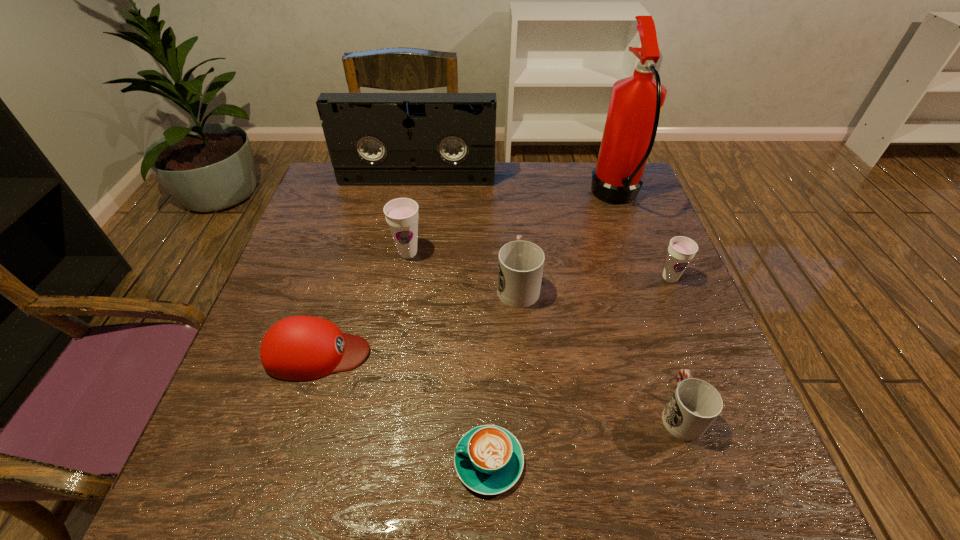
Locate an element on the screen. This screenshot has width=960, height=540. free space located on the handle side of the bigger red cup is located at coordinates (510, 183).

This screenshot has width=960, height=540. I want to click on vacant position located 0.270m on the handle side of the bigger red cup, so click(x=511, y=200).

You are a GUI agent. You are given a task and a screenshot of the screen. Output one action in this format:
    pyautogui.click(x=<x>, y=<y>)
    Task: Click on the free space located on the handle side of the bigger red cup
    This screenshot has height=540, width=960.
    Given the screenshot: What is the action you would take?
    pyautogui.click(x=512, y=210)

Where is `vacant space located 0.360m on the front of the rightmost cup`? Image resolution: width=960 pixels, height=540 pixels. vacant space located 0.360m on the front of the rightmost cup is located at coordinates (733, 433).

The width and height of the screenshot is (960, 540). Identify the location of vacant region located on the front-facing side of the third nearest object. (480, 353).

At what (x,y) coordinates should I click in order to perform the action: click on free space located on the handle side of the smaller red cup. Please return your answer as a coordinate pair (x, y). Looking at the image, I should click on (662, 362).

The width and height of the screenshot is (960, 540). I want to click on free space located 0.360m on the handle side of the smaller red cup, so click(629, 261).

The width and height of the screenshot is (960, 540). What are the coordinates of `vacant point located 0.210m on the handle side of the smaller red cup` in the screenshot? It's located at (644, 306).

Image resolution: width=960 pixels, height=540 pixels. Find the location of `vacant space situated 0.350m with the handle on the right side of the shortest object`. vacant space situated 0.350m with the handle on the right side of the shortest object is located at coordinates (253, 462).

Where is `vacant space positioned with the handle on the right side of the shortest object`? This screenshot has width=960, height=540. vacant space positioned with the handle on the right side of the shortest object is located at coordinates (357, 462).